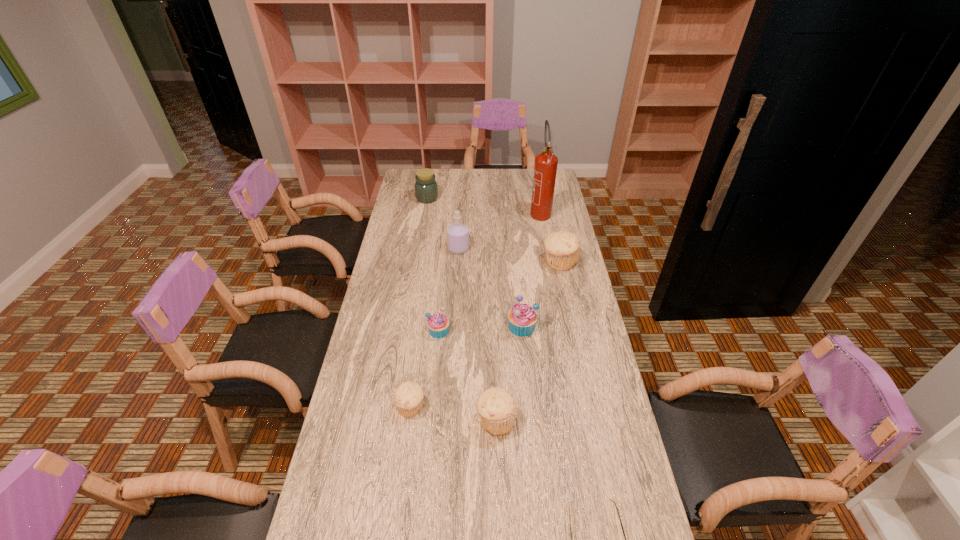
Where is `free space between the jar and the second beige muffin from left to right`? free space between the jar and the second beige muffin from left to right is located at coordinates (462, 309).

Identify the location of free space between the bigger blue muffin and the farthest muffin. (540, 294).

The height and width of the screenshot is (540, 960). Identify the location of vacant space that is in between the jar and the perfume. (443, 224).

Identify the location of vacant area that lies between the farthest beige muffin and the right blue muffin. Image resolution: width=960 pixels, height=540 pixels. (540, 294).

Where is `vacant space that's between the biggest beige muffin and the right blue muffin`? The image size is (960, 540). vacant space that's between the biggest beige muffin and the right blue muffin is located at coordinates (540, 294).

Point out which object is positioned as the fourth nearest to the sunglasses. Please provide its 2D coordinates. Your answer should be formatted as a tuple, i.e. [(x, y)], where the tuple contains the x and y coordinates of a point satisfying the conditions above.

[(438, 324)]

Locate which object ranks fifth in proximity to the bigger blue muffin. Please provide its 2D coordinates. Your answer should be formatted as a tuple, i.e. [(x, y)], where the tuple contains the x and y coordinates of a point satisfying the conditions above.

[(458, 233)]

Find the location of a particular element. muffin identified as the closest to the bigger blue muffin is located at coordinates (438, 324).

Identify which muffin is the second nearest to the farthest muffin. Please provide its 2D coordinates. Your answer should be formatted as a tuple, i.e. [(x, y)], where the tuple contains the x and y coordinates of a point satisfying the conditions above.

[(438, 324)]

Select which beige muffin is the closest to the bigger blue muffin. Please provide its 2D coordinates. Your answer should be formatted as a tuple, i.e. [(x, y)], where the tuple contains the x and y coordinates of a point satisfying the conditions above.

[(562, 248)]